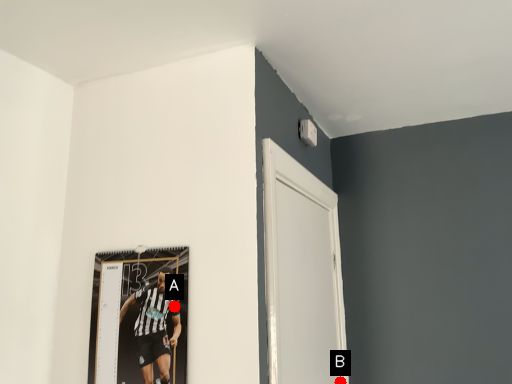
Question: Two points are circled on the image, labeled by A and B beside each circle. Which point is closer to the camera?

Choices:
 (A) A is closer
 (B) B is closer

Answer: (A)